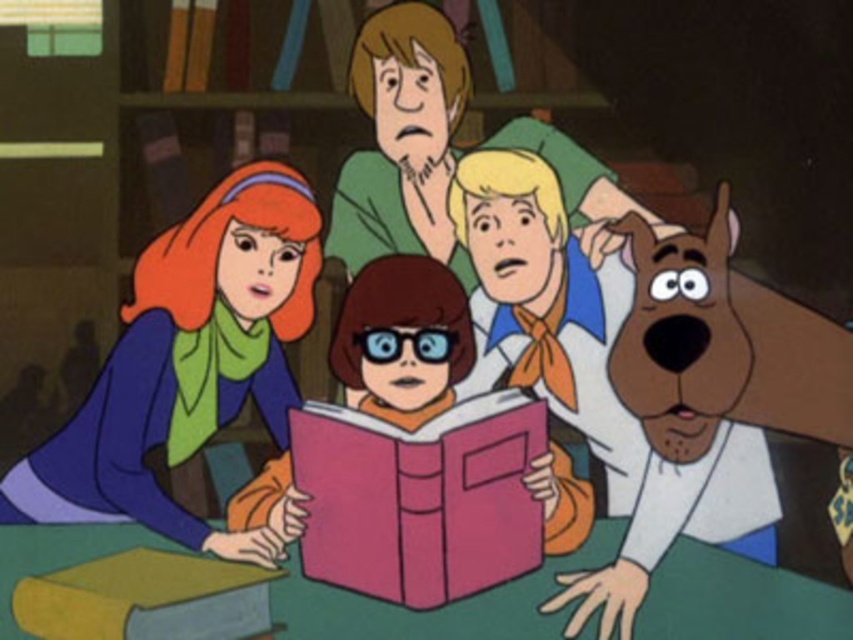
Question: Can you confirm if pink matte book at center is positioned above yellow matte book at lower left?

Choices:
 (A) no
 (B) yes

Answer: (B)

Question: Which object is farther from the camera taking this photo?

Choices:
 (A) pink matte book at center
 (B) yellow matte book at lower left
 (C) matte green sweater at left

Answer: (C)

Question: Considering the real-world distances, which object is farthest from the matte green sweater at left?

Choices:
 (A) pink matte book at center
 (B) yellow matte book at lower left

Answer: (A)

Question: Which point is closer to the camera?

Choices:
 (A) yellow matte book at lower left
 (B) matte green sweater at left

Answer: (A)

Question: Does matte green sweater at left have a greater width compared to pink matte book at center?

Choices:
 (A) yes
 (B) no

Answer: (A)

Question: Is matte green sweater at left closer to camera compared to pink matte book at center?

Choices:
 (A) no
 (B) yes

Answer: (A)